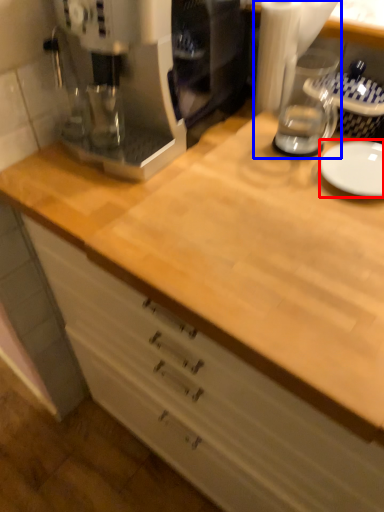
Question: Among these objects, which one is nearest to the camera, plate (highlighted by a red box) or blender (highlighted by a blue box)?

Choices:
 (A) plate
 (B) blender

Answer: (B)